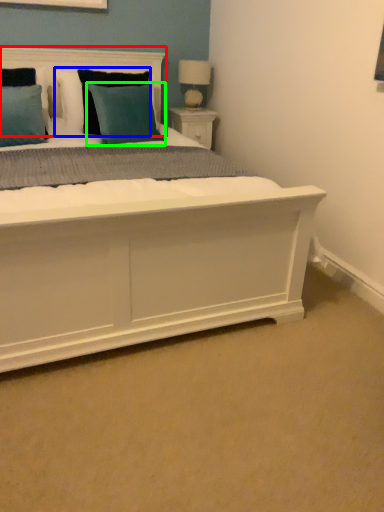
Question: Which object is the farthest from headboard (highlighted by a red box)? Choose among these: pillow (highlighted by a blue box) or pillow (highlighted by a green box).

Choices:
 (A) pillow
 (B) pillow

Answer: (B)